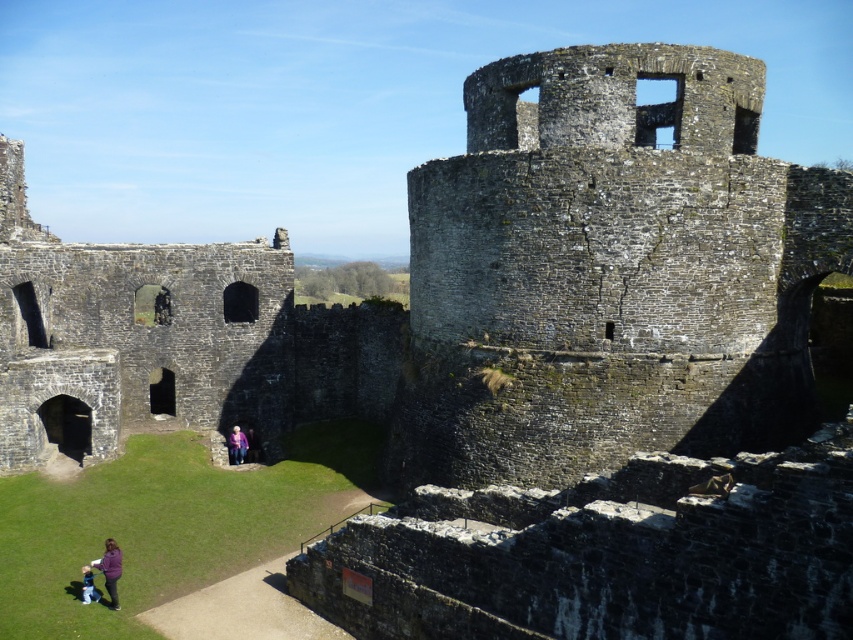
Is rusty stone tower at center behind pink fabric at lower left?

Yes, it is behind pink fabric at lower left.

Can you confirm if rusty stone tower at center is positioned to the right of pink fabric at lower left?

Yes, rusty stone tower at center is to the right of pink fabric at lower left.

Who is more forward, (555, 396) or (86, 586)?

Point (86, 586) is more forward.

The height and width of the screenshot is (640, 853). What are the coordinates of `rusty stone tower at center` in the screenshot? It's located at (608, 273).

Is point (473, 273) farther from camera compared to point (144, 365)?

That is False.

Does rusty stone tower at center come in front of dark gray stone ruins at center?

Yes, it is in front of dark gray stone ruins at center.

Is point (614, 56) behind point (97, 333)?

No, it is not.

The height and width of the screenshot is (640, 853). I want to click on rusty stone tower at center, so pyautogui.click(x=608, y=273).

Does point (590, 253) lie in front of point (236, 426)?

Yes, point (590, 253) is closer to viewer.

Which is more to the right, rusty stone tower at center or purple woolen sweater at center?

From the viewer's perspective, rusty stone tower at center appears more on the right side.

The image size is (853, 640). I want to click on rusty stone tower at center, so click(608, 273).

Locate an element on the screen. rusty stone tower at center is located at coordinates (608, 273).